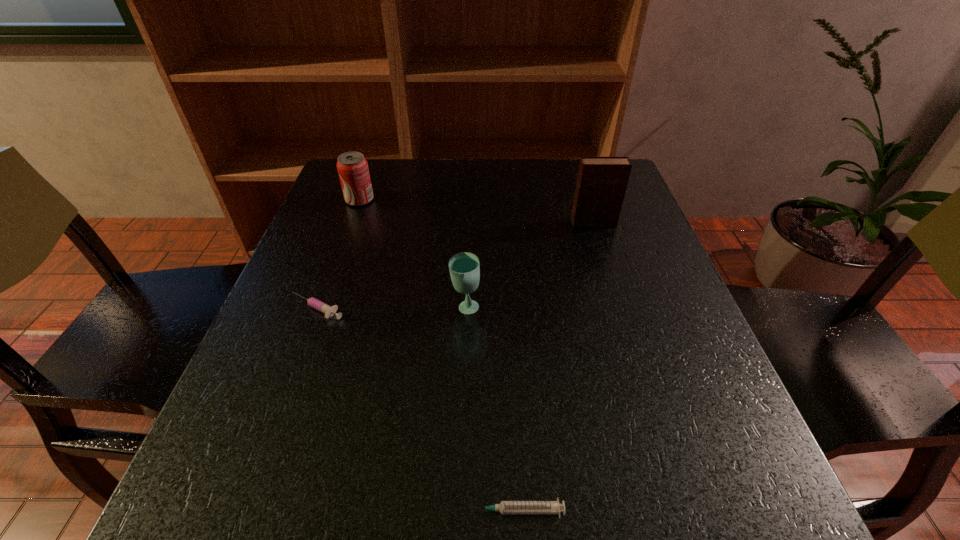
Where is `free space at the far edge of the desktop`? This screenshot has height=540, width=960. free space at the far edge of the desktop is located at coordinates (555, 159).

Where is `blank space at the near edge of the desktop`? This screenshot has width=960, height=540. blank space at the near edge of the desktop is located at coordinates (409, 519).

In the image, there is a desktop. Where is `free space at the left edge`? The image size is (960, 540). free space at the left edge is located at coordinates (300, 376).

The image size is (960, 540). In order to click on vacant area at the right edge in this screenshot , I will do `click(659, 393)`.

Find the location of a particular element. vacant space at the far left corner is located at coordinates (392, 163).

In the image, there is a desktop. Identify the location of blank space at the far right corner. (575, 170).

Image resolution: width=960 pixels, height=540 pixels. I want to click on free region at the near right corner, so click(x=745, y=480).

This screenshot has height=540, width=960. I want to click on vacant space that's between the nearest object and the diary, so click(x=555, y=367).

Where is `free point between the diary and the glass`? free point between the diary and the glass is located at coordinates point(529,265).

Locate an element on the screen. The height and width of the screenshot is (540, 960). unoccupied position between the right syringe and the farther syringe is located at coordinates (417, 409).